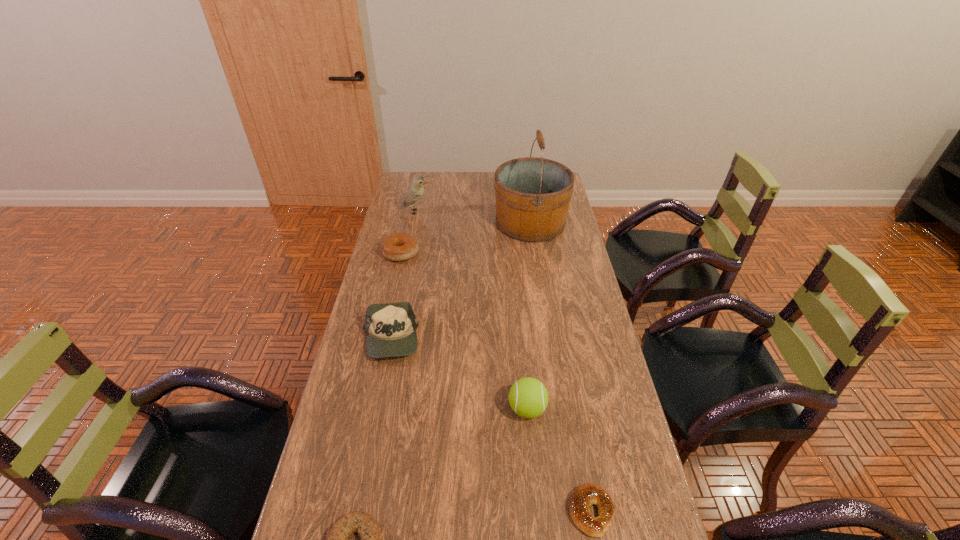
The width and height of the screenshot is (960, 540). Find the location of `the tallest object`. the tallest object is located at coordinates (532, 194).

Where is `the second tallest object`? The height and width of the screenshot is (540, 960). the second tallest object is located at coordinates pyautogui.click(x=415, y=192).

Locate an element on the screen. This screenshot has height=540, width=960. the third nearest object is located at coordinates (528, 397).

The image size is (960, 540). In order to click on the third tallest object in this screenshot , I will do `click(528, 397)`.

Locate an element on the screen. The width and height of the screenshot is (960, 540). the fourth tallest object is located at coordinates (391, 328).

Locate an element on the screen. baseball cap is located at coordinates (391, 328).

Image resolution: width=960 pixels, height=540 pixels. What are the coordinates of `the tallest bagel` in the screenshot? It's located at (397, 247).

Where is `the fifth tallest object`? the fifth tallest object is located at coordinates (397, 247).

Where is `the rightmost bagel`? Image resolution: width=960 pixels, height=540 pixels. the rightmost bagel is located at coordinates (588, 494).

Locate an element on the screen. Image resolution: width=960 pixels, height=540 pixels. vacant space located 0.130m on the left of the bucket is located at coordinates (464, 222).